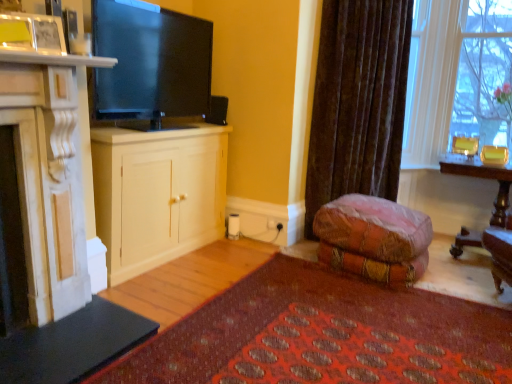
Question: From a real-world perspective, is white marble fireplace at left, marked as the first cabinetry in a front-to-back arrangement, above or below white wood cabinet at center, the 1th cabinetry in the back-to-front sequence?

Choices:
 (A) above
 (B) below

Answer: (A)

Question: Is white marble fireplace at left, marked as the first cabinetry in a front-to-back arrangement, wider or thinner than white wood cabinet at center, the 1th cabinetry in the back-to-front sequence?

Choices:
 (A) wide
 (B) thin

Answer: (B)

Question: Which object is positioned farthest from the white marble fireplace at left, marked as the first cabinetry in a front-to-back arrangement?

Choices:
 (A) velvet-like fabric couch at lower center
 (B) clear glass vase at upper right
 (C) matte black tv at upper center
 (D) white wood cabinet at center, which is counted as the second cabinetry, starting from the front
 (E) velvet brown curtain at center

Answer: (B)

Question: Based on their relative distances, which object is farther from the white wood cabinet at center, the 1th cabinetry in the back-to-front sequence?

Choices:
 (A) textured wool rug at lower center
 (B) matte black tv at upper center
 (C) wooden polished desk at right
 (D) velvet-like fabric couch at lower center
 (E) white marble fireplace at left, which is counted as the second cabinetry, starting from the back

Answer: (C)